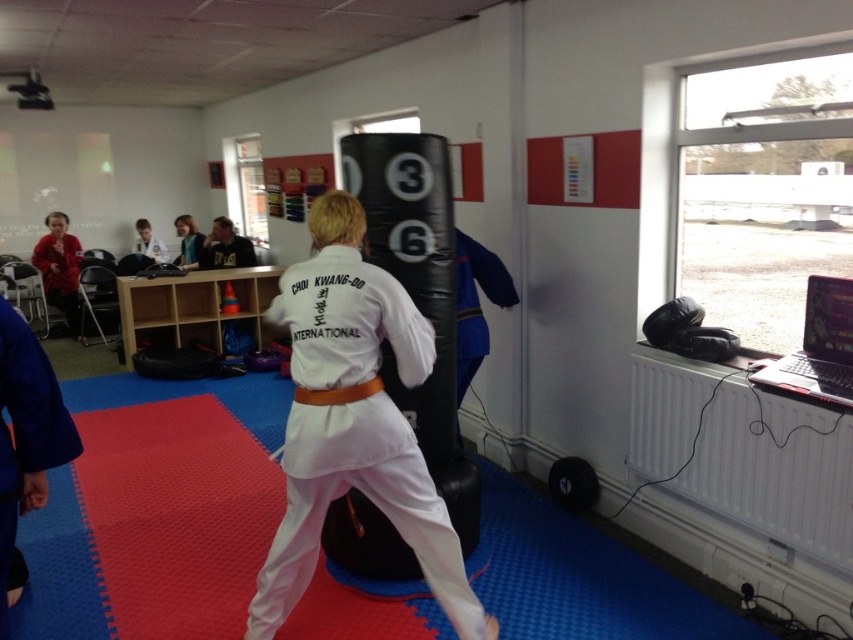
Can you confirm if white fabric karate gi at center is bigger than dark brown leather jacket at center?

Indeed, white fabric karate gi at center has a larger size compared to dark brown leather jacket at center.

Does white fabric karate gi at center have a lesser width compared to dark brown leather jacket at center?

Incorrect, white fabric karate gi at center's width is not less than dark brown leather jacket at center's.

Between point (314, 339) and point (204, 244), which one is positioned in front?

Point (314, 339) is in front.

Find the location of a particular element. white fabric karate gi at center is located at coordinates tap(354, 420).

How much distance is there between matte red jacket at left and smooth blue shirt at upper center?

matte red jacket at left is 3.76 feet away from smooth blue shirt at upper center.

Does matte red jacket at left appear over smooth blue shirt at upper center?

No, matte red jacket at left is not above smooth blue shirt at upper center.

This screenshot has width=853, height=640. Describe the element at coordinates (61, 269) in the screenshot. I see `matte red jacket at left` at that location.

Identify the location of matte red jacket at left. (61, 269).

Who is more forward, (210, 248) or (177, 228)?

Point (210, 248) is more forward.

Is dark brown leather jacket at center in front of smooth blue shirt at upper center?

Yes, dark brown leather jacket at center is in front of smooth blue shirt at upper center.

The image size is (853, 640). What do you see at coordinates (225, 246) in the screenshot? I see `dark brown leather jacket at center` at bounding box center [225, 246].

This screenshot has width=853, height=640. I want to click on dark brown leather jacket at center, so click(225, 246).